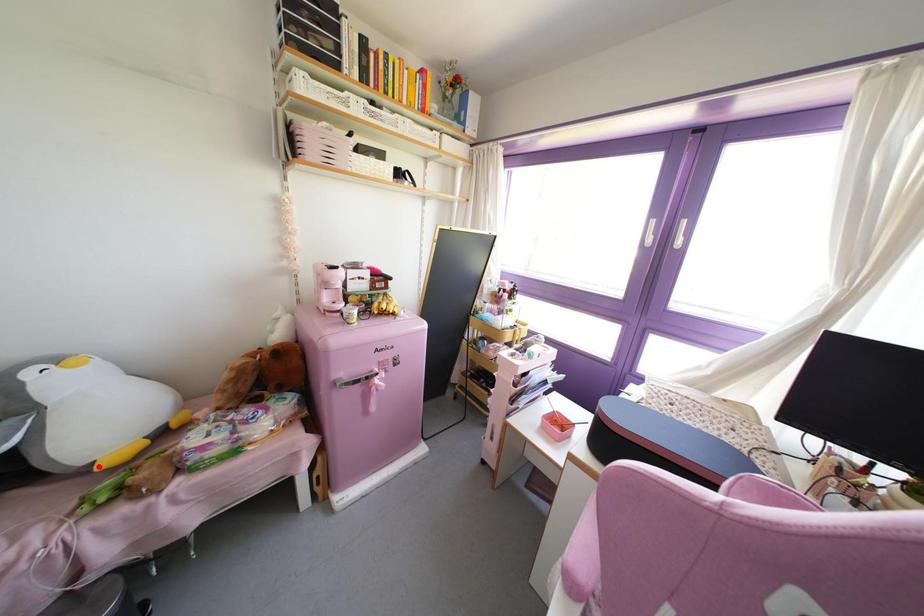
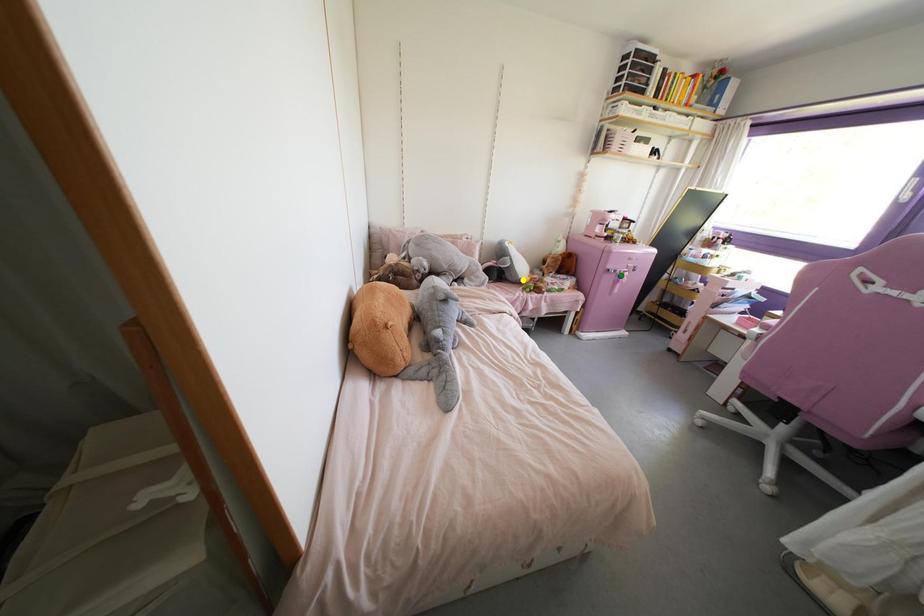
Question: I am providing you with two images of the same scene from different viewpoints. A red point is marked on the first image. You are given multiple points on the second image. Which mark in image 2 goes with the point in image 1?

Choices:
 (A) blue point
 (B) yellow point
 (C) green point

Answer: (B)